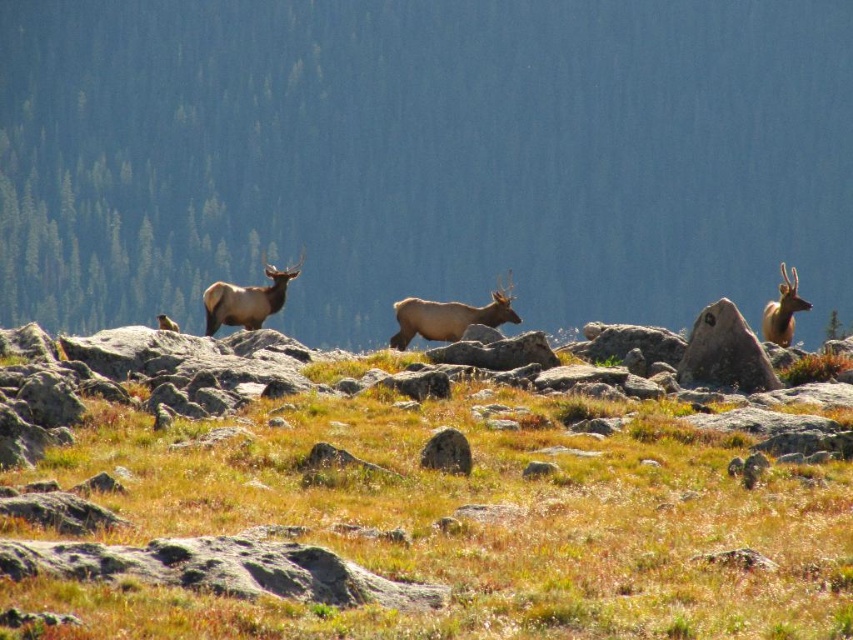
Question: Which object is farther from the camera taking this photo?

Choices:
 (A) smooth gray rock at center right
 (B) brown rocky mountain at center
 (C) brown velvet deer at center
 (D) brown grassy at center

Answer: (B)

Question: Does brown rocky mountain at center appear on the left side of brown velvet deer at center?

Choices:
 (A) no
 (B) yes

Answer: (A)

Question: Considering the real-world distances, which object is farthest from the brown grassy at center?

Choices:
 (A) brown matte/deer at center
 (B) brown rocky mountain at center
 (C) brown velvet deer at right
 (D) brown velvet deer at center

Answer: (B)

Question: Among these points, which one is nearest to the camera?

Choices:
 (A) (271, 307)
 (B) (412, 296)

Answer: (A)

Question: Can you confirm if brown matte/deer at center is smaller than brown velvet deer at right?

Choices:
 (A) no
 (B) yes

Answer: (B)

Question: From the image, what is the correct spatial relationship of brown grassy at center in relation to smooth gray rock at center right?

Choices:
 (A) below
 (B) above

Answer: (A)